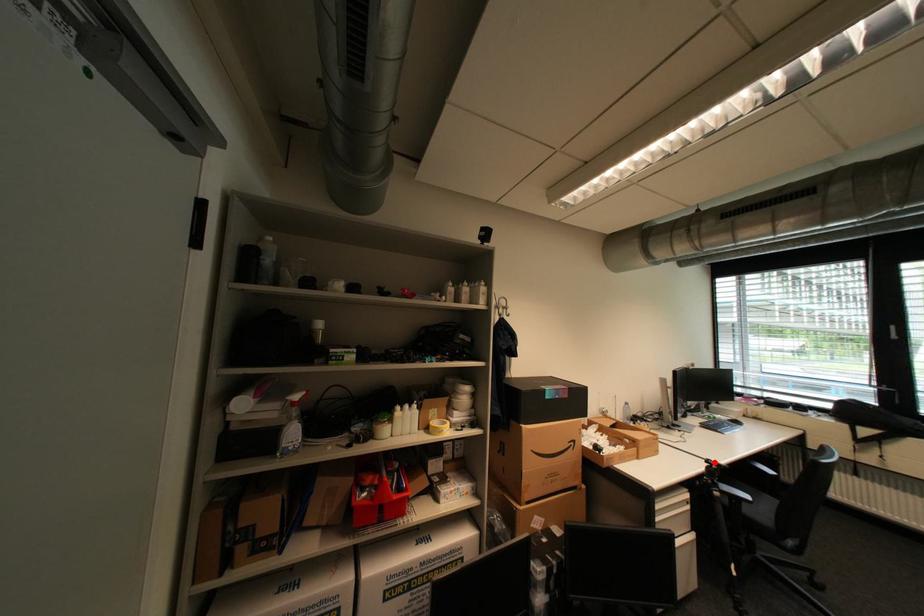
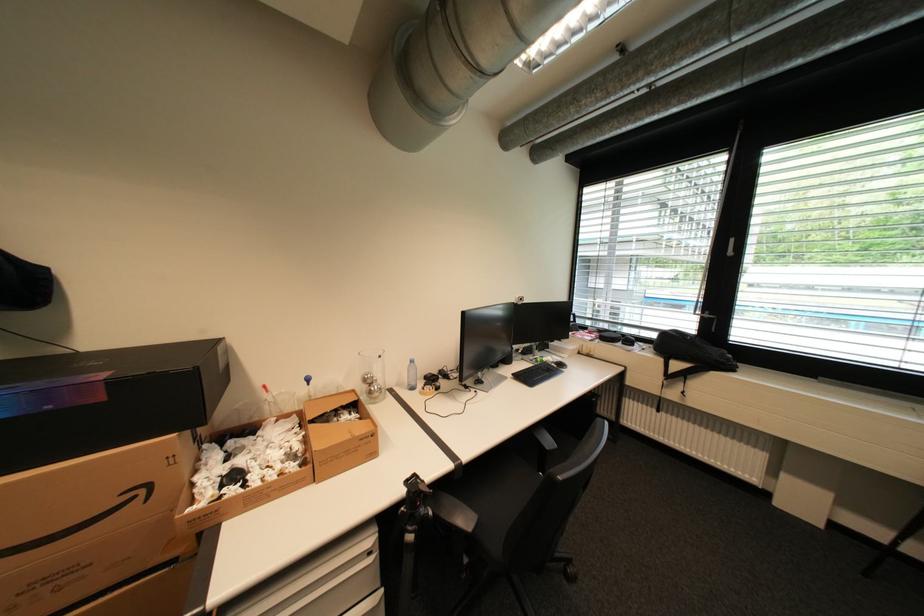
Find the pixel in the second image that matches the highlighted location in the first image.

(416, 484)